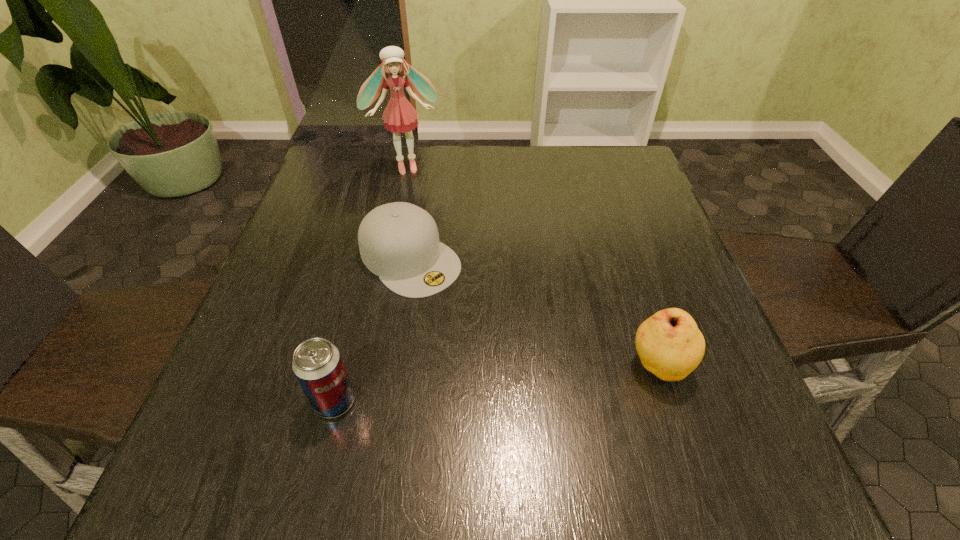
At what (x,y) coordinates should I click in order to perform the action: click on beer can. Please return your answer as a coordinate pair (x, y). Looking at the image, I should click on (317, 364).

This screenshot has height=540, width=960. In order to click on the rightmost object in this screenshot , I will do `click(670, 345)`.

What are the coordinates of `the tallest object` in the screenshot? It's located at (399, 116).

The image size is (960, 540). I want to click on doll, so click(399, 116).

Identify the location of the second farthest object. (399, 242).

Image resolution: width=960 pixels, height=540 pixels. Identify the location of the shortest object. (399, 242).

Locate an element on the screen. The height and width of the screenshot is (540, 960). vacant space situated 0.070m on the back of the beer can is located at coordinates (348, 349).

Image resolution: width=960 pixels, height=540 pixels. Find the location of `free region located 0.080m on the back of the pear`. free region located 0.080m on the back of the pear is located at coordinates (639, 308).

Find the location of `vacant space located on the front-facing side of the tallest object`. vacant space located on the front-facing side of the tallest object is located at coordinates (420, 207).

Where is `vacant position located 0.220m on the front-facing side of the tallest object`? The height and width of the screenshot is (540, 960). vacant position located 0.220m on the front-facing side of the tallest object is located at coordinates (425, 227).